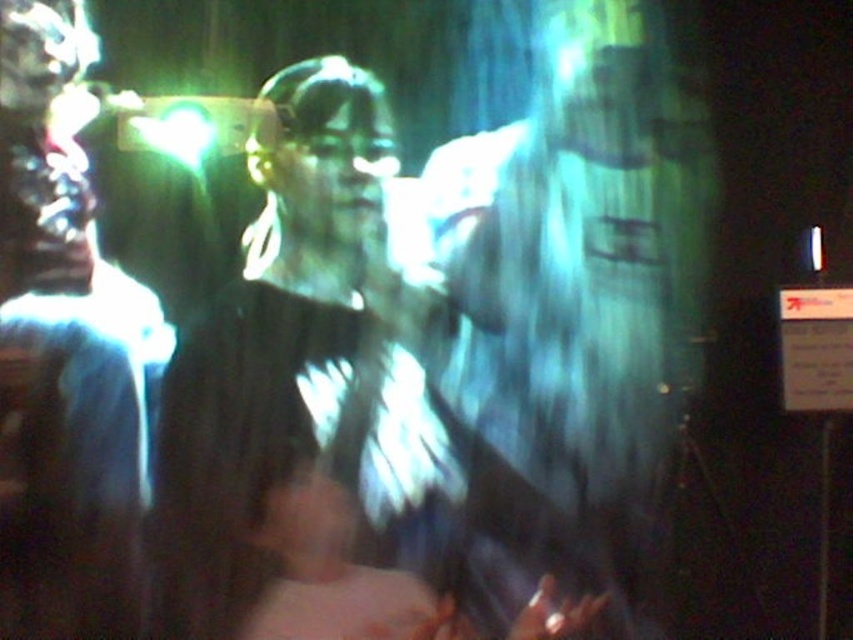
You are a delivery person who needs to pack a fragile item that requires a protective cover. You have a translucent plastic bag at center and a matte black jacket at center available. Which object can you use to wrap the item if you need something wider than 30 cm?

The translucent plastic bag at center can be used to wrap the item since its width is larger than the matte black jacket at center, and if the jacket is narrower than 30 cm, the bag would be wider than 30 cm as well.

You are a delivery person who needs to place a matte black shirt at center into a translucent plastic bag at center. Based on the scene description, will the bag be wide enough to fit the shirt?

The translucent plastic bag at center has a greater width than the matte black shirt at center, so the bag should be wide enough to accommodate the shirt.